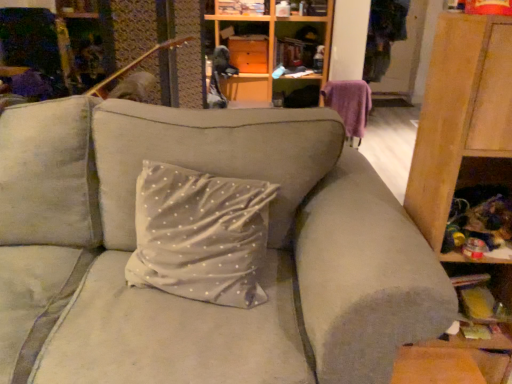
Question: Could you tell me if purple fabric swivel chair at upper right is turned towards matte wood cabinet at upper center?

Choices:
 (A) yes
 (B) no

Answer: (B)

Question: Considering the relative positions of purple fabric swivel chair at upper right and matte wood cabinet at upper center in the image provided, is purple fabric swivel chair at upper right in front of matte wood cabinet at upper center?

Choices:
 (A) no
 (B) yes

Answer: (B)

Question: Does purple fabric swivel chair at upper right have a larger size compared to matte wood cabinet at upper center?

Choices:
 (A) yes
 (B) no

Answer: (A)

Question: Considering the relative sizes of purple fabric swivel chair at upper right and matte wood cabinet at upper center in the image provided, is purple fabric swivel chair at upper right shorter than matte wood cabinet at upper center?

Choices:
 (A) yes
 (B) no

Answer: (B)

Question: From the image's perspective, would you say purple fabric swivel chair at upper right is positioned over matte wood cabinet at upper center?

Choices:
 (A) yes
 (B) no

Answer: (B)

Question: Looking at their shapes, would you say matte wood cabinet at upper center is wider or thinner than purple fabric swivel chair at upper right?

Choices:
 (A) thin
 (B) wide

Answer: (B)

Question: Does point (314, 54) appear closer or farther from the camera than point (357, 105)?

Choices:
 (A) farther
 (B) closer

Answer: (A)

Question: Is matte wood cabinet at upper center in front of or behind purple fabric swivel chair at upper right in the image?

Choices:
 (A) front
 (B) behind

Answer: (B)

Question: Based on their positions, is matte wood cabinet at upper center located to the left or right of purple fabric swivel chair at upper right?

Choices:
 (A) right
 (B) left

Answer: (B)

Question: In terms of size, does matte wood cabinet at upper center appear bigger or smaller than light gray fabric couch at center?

Choices:
 (A) small
 (B) big

Answer: (A)

Question: Choose the correct answer: Is matte wood cabinet at upper center inside light gray fabric couch at center or outside it?

Choices:
 (A) inside
 (B) outside

Answer: (B)

Question: Considering their positions, is matte wood cabinet at upper center located in front of or behind light gray fabric couch at center?

Choices:
 (A) behind
 (B) front

Answer: (A)

Question: From the image's perspective, is matte wood cabinet at upper center above or below light gray fabric couch at center?

Choices:
 (A) below
 (B) above

Answer: (B)

Question: Based on their sizes in the image, would you say wooden cabinet at right is bigger or smaller than purple fabric swivel chair at upper right?

Choices:
 (A) big
 (B) small

Answer: (A)

Question: Considering the relative positions of wooden cabinet at right and purple fabric swivel chair at upper right in the image provided, is wooden cabinet at right to the left or to the right of purple fabric swivel chair at upper right?

Choices:
 (A) left
 (B) right

Answer: (A)